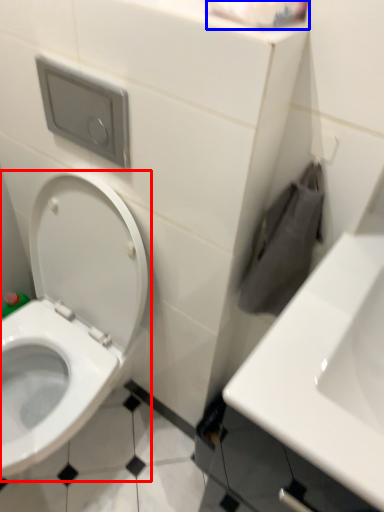
Question: Which point is further to the camera, toilet (highlighted by a red box) or toilet paper (highlighted by a blue box)?

Choices:
 (A) toilet
 (B) toilet paper

Answer: (A)